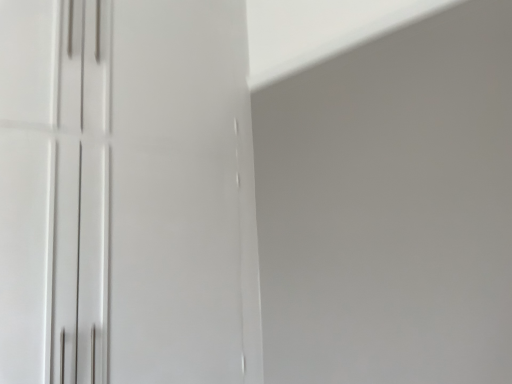
This screenshot has height=384, width=512. Describe the element at coordinates (126, 193) in the screenshot. I see `white glossy door at upper left` at that location.

The image size is (512, 384). Find the location of `white glossy door at upper left`. white glossy door at upper left is located at coordinates (126, 193).

Where is `white glossy door at upper left`? The image size is (512, 384). white glossy door at upper left is located at coordinates (126, 193).